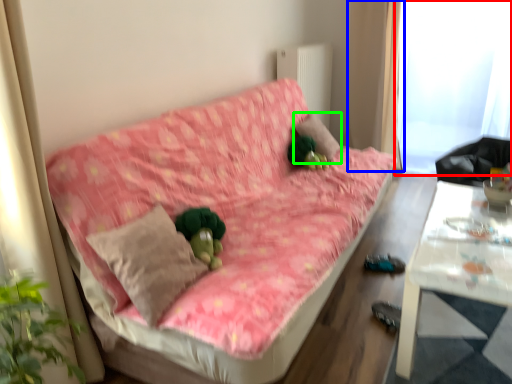
Question: Which is farther away from window screen (highlighted by a red box)? curtain (highlighted by a blue box) or pillow (highlighted by a green box)?

Choices:
 (A) curtain
 (B) pillow

Answer: (B)